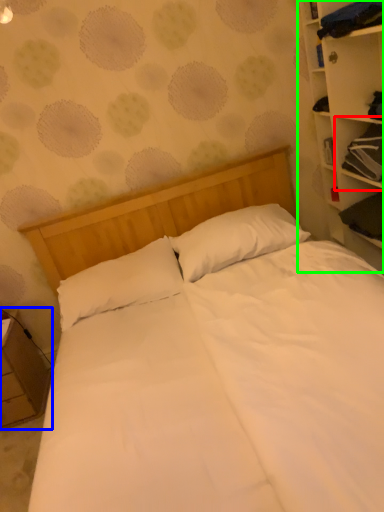
Question: Considering the real-world distances, which object is farthest from cabinet (highlighted by a red box)? nightstand (highlighted by a blue box) or bookcase (highlighted by a green box)?

Choices:
 (A) nightstand
 (B) bookcase

Answer: (A)